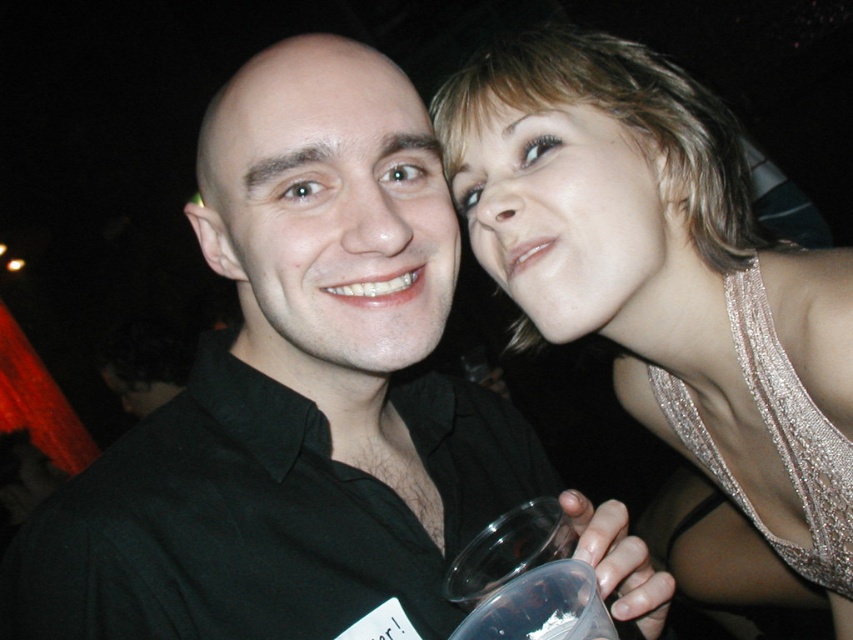
Question: Is black matte shirt at center positioned in front of sparkly gold dress at upper right?

Choices:
 (A) no
 (B) yes

Answer: (B)

Question: Is sparkly gold dress at upper right wider than smooth skin face at upper right?

Choices:
 (A) no
 (B) yes

Answer: (B)

Question: Can you confirm if smooth skin face at upper right is positioned to the right of transparent plastic cup at lower center?

Choices:
 (A) no
 (B) yes

Answer: (B)

Question: Estimate the real-world distances between objects in this image. Which object is closer to the smooth black shirt at center?

Choices:
 (A) transparent plastic cup at lower center
 (B) sparkly silver dress at upper right

Answer: (A)

Question: Which point is farther from the camera taking this photo?

Choices:
 (A) (512, 125)
 (B) (624, 513)

Answer: (A)

Question: Estimate the real-world distances between objects in this image. Which object is farther from the smooth black shirt at center?

Choices:
 (A) black matte shirt at center
 (B) transparent plastic cup at lower center
 (C) sparkly silver dress at upper right

Answer: (C)